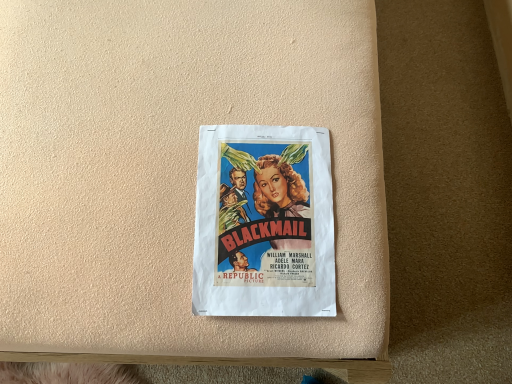
The image size is (512, 384). Identify the location of free space above matte paper poster at center (from a real-world perspective). (256, 203).